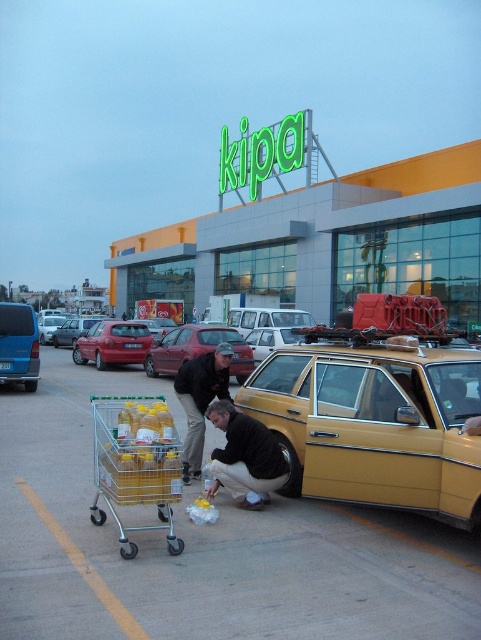
Is green sign at upper center positioned in front of metallic red car at left?

No, it is behind metallic red car at left.

Is the position of green sign at upper center more distant than that of metallic red car at left?

That is True.

The height and width of the screenshot is (640, 481). Describe the element at coordinates (320, 241) in the screenshot. I see `green sign at upper center` at that location.

Identify the location of green sign at upper center. (320, 241).

Can you confirm if dark brown leather jacket at center is positioned to the right of red matte sedan at center?

Correct, you'll find dark brown leather jacket at center to the right of red matte sedan at center.

Consider the image. Who is taller, dark brown leather jacket at center or red matte sedan at center?

dark brown leather jacket at center is taller.

Is point (198, 385) more distant than point (64, 333)?

No, it is not.

Where is `dark brown leather jacket at center`? The width and height of the screenshot is (481, 640). dark brown leather jacket at center is located at coordinates (201, 400).

Is yellow car at lower right wider than metallic red car at left?

Correct, the width of yellow car at lower right exceeds that of metallic red car at left.

Can you confirm if yellow car at lower right is positioned to the right of metallic red car at left?

Yes, yellow car at lower right is to the right of metallic red car at left.

Where is `yellow car at lower right`? The image size is (481, 640). yellow car at lower right is located at coordinates (203, 547).

This screenshot has width=481, height=640. In order to click on yellow car at lower right in this screenshot , I will do `click(203, 547)`.